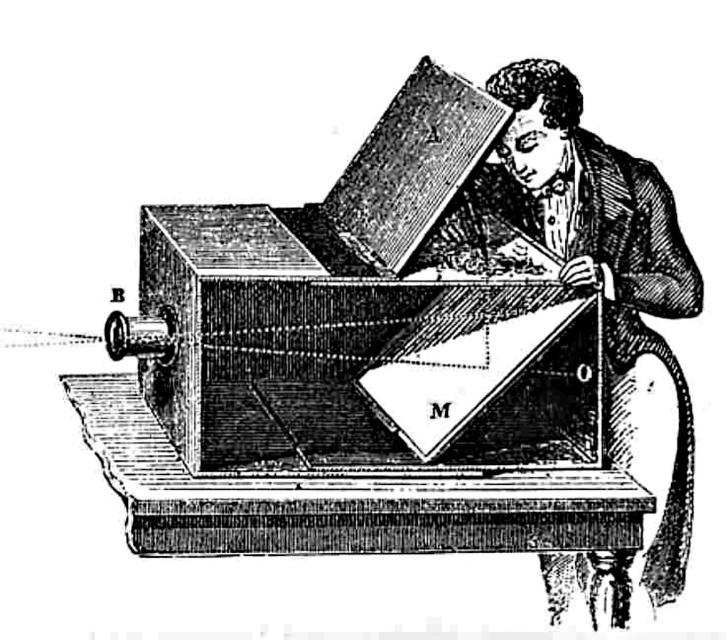
You are an art conservator examining this historical engraving. The wooden piano at center and wooden coat at upper right are both present in the image. Which object is placed higher up in the composition?

The wooden piano at center is positioned over the wooden coat at upper right, meaning it is higher up in the composition.

You are a visitor at a historical exhibition and notice the wooden piano at center and the wooden coat at upper right displayed in the same room. Which object is shorter in height?

The wooden piano at center is shorter in height compared to the wooden coat at upper right.